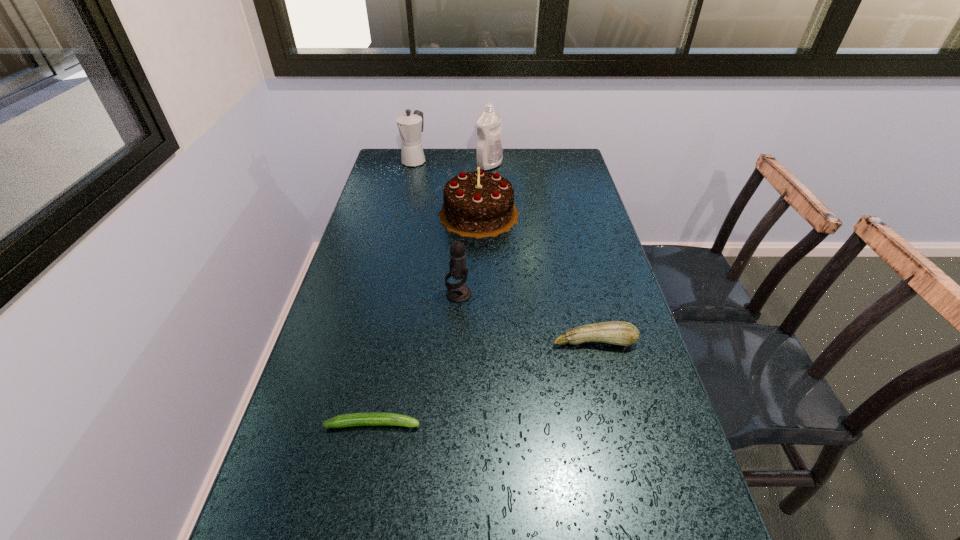
In order to click on free space at the far edge of the desktop in this screenshot , I will do `click(427, 156)`.

At what (x,y) coordinates should I click in order to perform the action: click on free space at the left edge of the desktop. Please return your answer as a coordinate pair (x, y). The width and height of the screenshot is (960, 540). Looking at the image, I should click on (332, 367).

The image size is (960, 540). What are the coordinates of `free location at the right edge of the desktop` in the screenshot? It's located at (587, 285).

Find the location of a particular element. vacant space at the far left corner of the desktop is located at coordinates (405, 174).

Image resolution: width=960 pixels, height=540 pixels. In the image, there is a desktop. Identify the location of vacant space at the far right corner. (571, 177).

Find the location of a particular element. The height and width of the screenshot is (540, 960). vacant space that's between the coffeepot and the second nearest object is located at coordinates (504, 251).

Identify the location of vacant space that's between the taller zucchini and the detergent. (541, 253).

Image resolution: width=960 pixels, height=540 pixels. What are the coordinates of `empty space that is in between the fifth farthest object and the shorter zucchini` in the screenshot? It's located at (484, 382).

Where is `blank region between the farther zucchini and the third nearest object`? blank region between the farther zucchini and the third nearest object is located at coordinates (526, 318).

Identify the location of vacant region between the nearest object and the detergent. Image resolution: width=960 pixels, height=540 pixels. (431, 294).